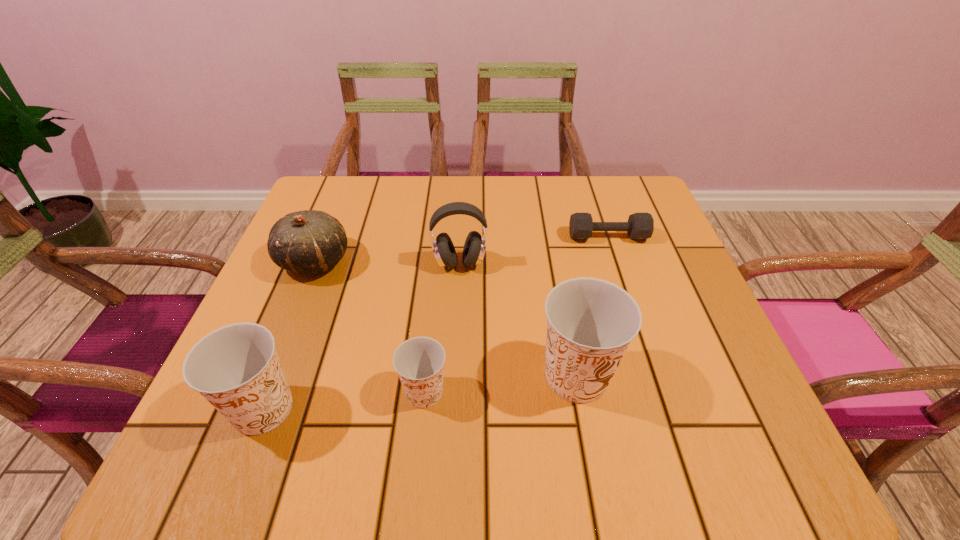
Where is `vacant space at the near edge of the desktop`? Image resolution: width=960 pixels, height=540 pixels. vacant space at the near edge of the desktop is located at coordinates (429, 411).

Where is `free space at the left edge`? free space at the left edge is located at coordinates (291, 312).

The width and height of the screenshot is (960, 540). I want to click on free point at the right edge, so click(x=648, y=308).

The image size is (960, 540). What are the coordinates of `vacant region at the far left corner of the desktop` in the screenshot? It's located at (352, 183).

Locate an element on the screen. free space at the far right corner is located at coordinates (600, 204).

At what (x,y) coordinates should I click in order to perform the action: click on blank space at the near right corner. Please return your answer as a coordinate pair (x, y). The height and width of the screenshot is (540, 960). Looking at the image, I should click on (681, 390).

Locate an element on the screen. vacant area between the headset and the second Dixie cup from left to right is located at coordinates (443, 327).

The image size is (960, 540). Identify the location of vacant space that's between the fifth tallest object and the rightmost Dixie cup. (500, 383).

Identify the location of free spot between the second tallest Dixie cup and the fourth tallest object. Image resolution: width=960 pixels, height=540 pixels. (289, 335).

Image resolution: width=960 pixels, height=540 pixels. I want to click on free spot between the headset and the fourth tallest object, so click(x=387, y=262).